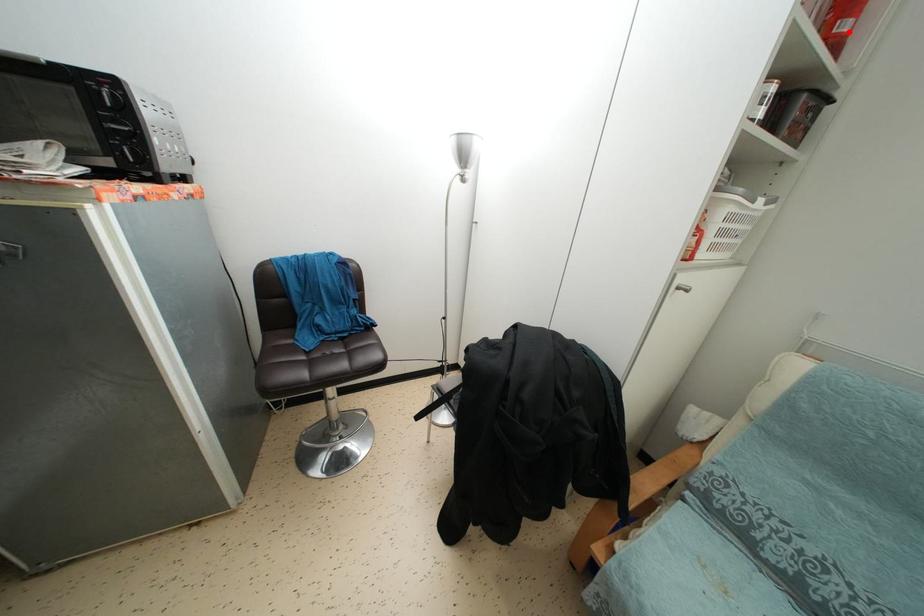
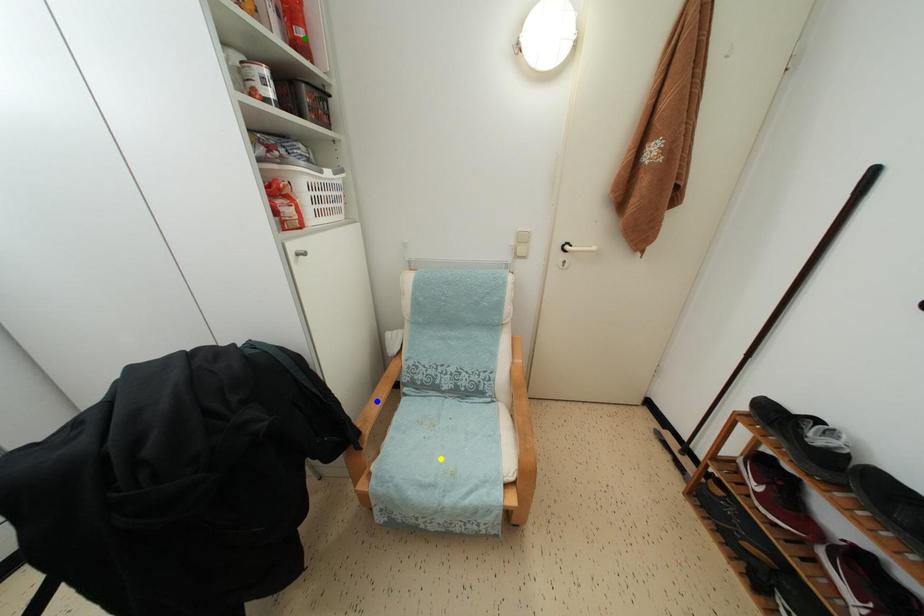
Question: I am providing you with two images of the same scene from different viewpoints. A red point is marked on the first image. You are given multiple points on the second image. Which point in image 2 represents the same 3d spot as the red point in image 1?

Choices:
 (A) blue point
 (B) green point
 (C) yellow point

Answer: (B)